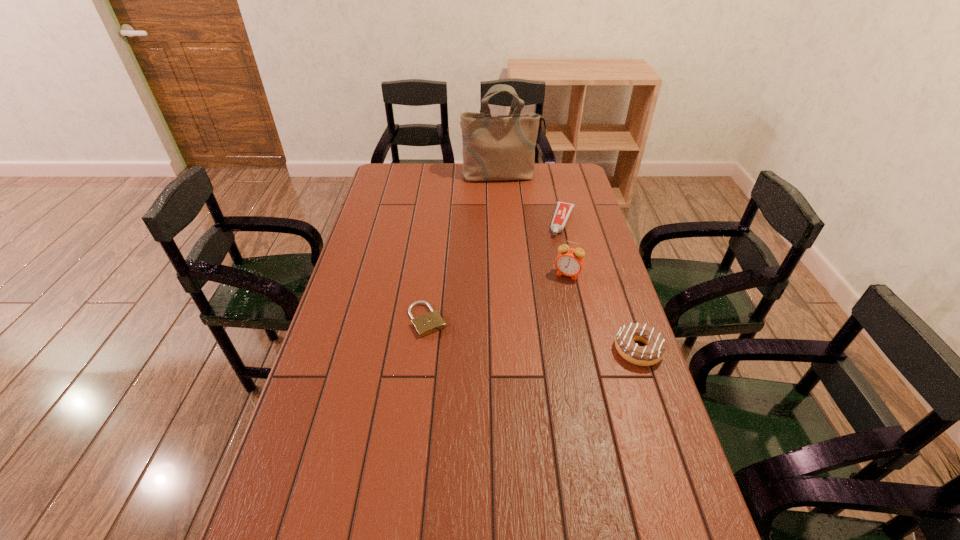
Identify the location of the shortest object. The height and width of the screenshot is (540, 960). (431, 322).

The image size is (960, 540). Find the location of `the leftmost object`. the leftmost object is located at coordinates (431, 322).

Find the location of a particular element. the rightmost object is located at coordinates (654, 351).

Where is `doughnut`? The image size is (960, 540). doughnut is located at coordinates (654, 351).

Locate an element on the screen. This screenshot has width=960, height=540. the fourth shortest object is located at coordinates (569, 262).

This screenshot has width=960, height=540. Identify the location of the third farthest object. (569, 262).

This screenshot has width=960, height=540. In order to click on the tallest object in this screenshot , I will do `click(495, 147)`.

Where is `shoulder bag`? shoulder bag is located at coordinates (495, 147).

You are a GUI agent. You are given a task and a screenshot of the screen. Output one action in this format:
    pyautogui.click(x=<x>, y=<y>)
    Task: Click on the second farthest object
    The height and width of the screenshot is (540, 960).
    Given the screenshot: What is the action you would take?
    pyautogui.click(x=563, y=210)

You are a GUI agent. You are given a task and a screenshot of the screen. Output one action in this format:
    pyautogui.click(x=<x>, y=<y>)
    Task: Click on the toothpaste
    
    Given the screenshot: What is the action you would take?
    pyautogui.click(x=563, y=210)